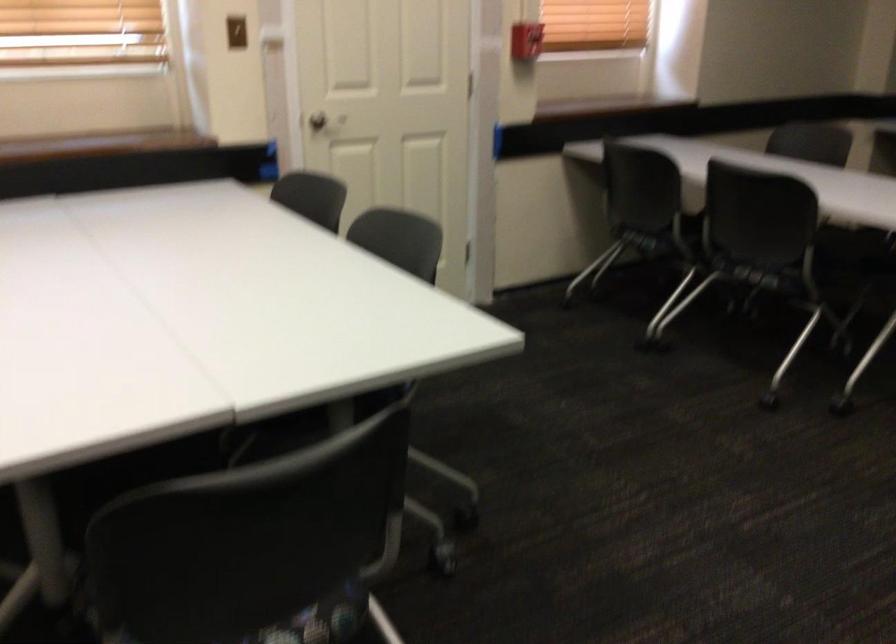
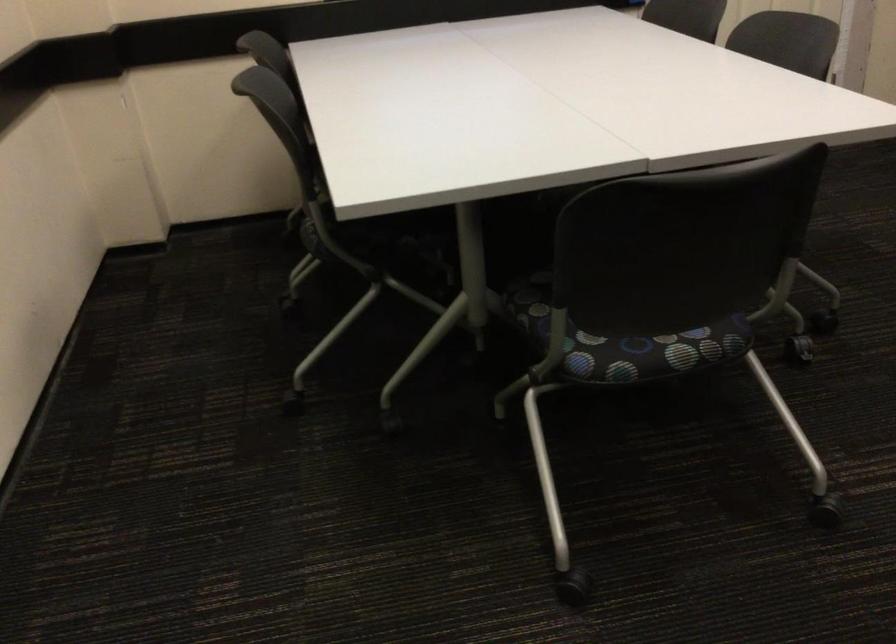
Question: The camera is either moving clockwise (left) or counter-clockwise (right) around the object. The first image is from the beginning of the video and the second image is from the end. Is the camera moving left or right when shooting the video?

Choices:
 (A) Left
 (B) Right

Answer: (B)